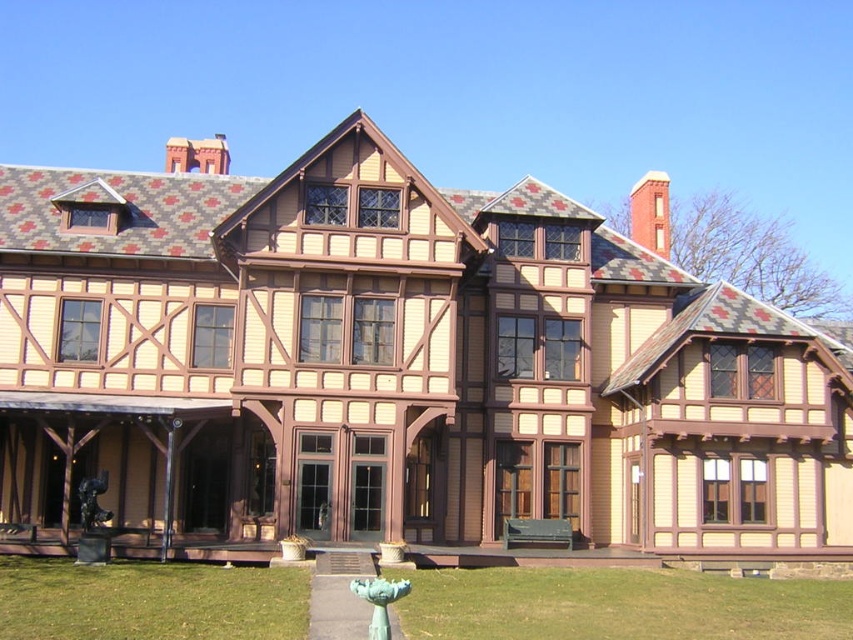
Question: Which point is farther from the camera taking this photo?

Choices:
 (A) (544, 556)
 (B) (91, 620)

Answer: (A)

Question: Among these points, which one is nearest to the camera?

Choices:
 (A) (628, 564)
 (B) (27, 568)
 (C) (759, 611)

Answer: (C)

Question: Which object appears farthest from the camera in this image?

Choices:
 (A) green grass at lower left
 (B) green grass at lower center

Answer: (B)

Question: Can you confirm if green grass at lower center is positioned to the left of brown wood porch at center?

Choices:
 (A) yes
 (B) no

Answer: (B)

Question: Can you confirm if green grass at lower center is positioned above brown wood porch at center?

Choices:
 (A) no
 (B) yes

Answer: (A)

Question: Does green grass at lower left lie behind brown wood porch at center?

Choices:
 (A) yes
 (B) no

Answer: (B)